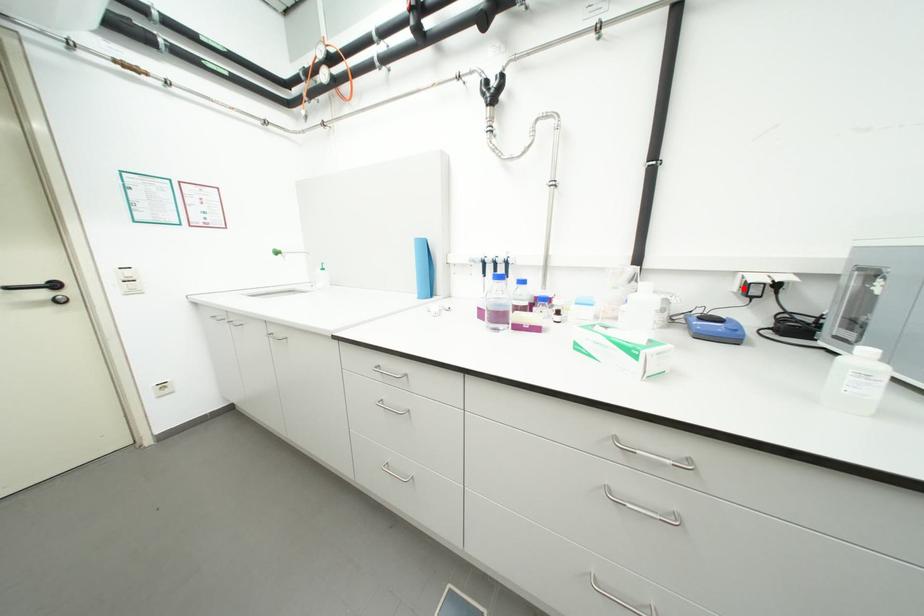
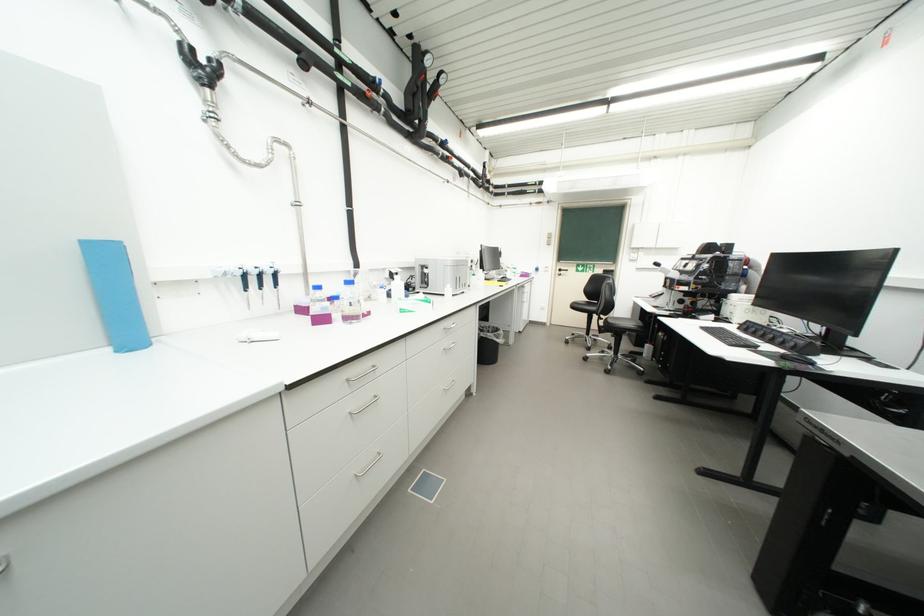
In the second image, find the point that corresponds to the highlighted location in the first image.

(395, 277)